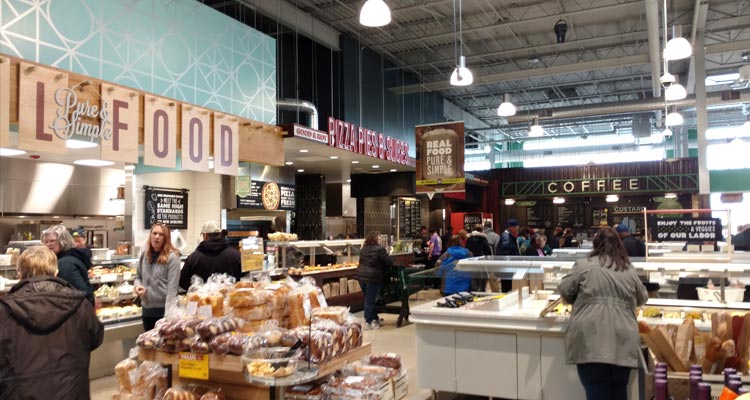
The width and height of the screenshot is (750, 400). In order to click on deli counter display case, left side in this screenshot , I will do `click(112, 290)`.